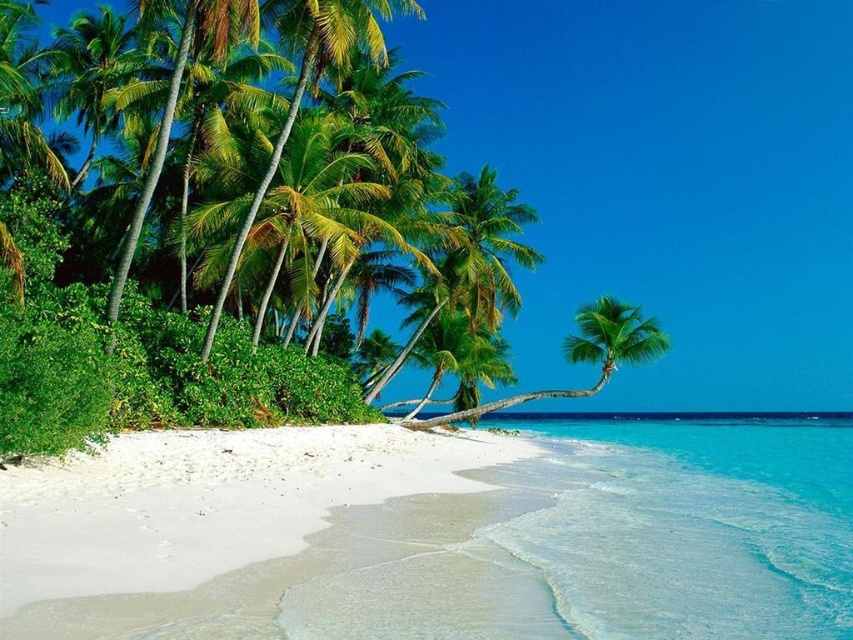
You are planning to set up a small tent on the white sandy beach at lower left and the green leafy palm tree at center. Based on their sizes, which location would provide more space for the tent?

The white sandy beach at lower left has a larger size compared to the green leafy palm tree at center, so setting up the tent there would provide more space.

Looking at this image, you are standing on the white sandy beach at lower left and want to reach the green leafy palm tree at center. Which direction should you move to get closer to the palm tree?

You should move towards the center of the image because the white sandy beach at lower left is in front of the green leafy palm tree at center, meaning the palm tree is behind the beach area from your current position.

You are standing at the point marked by the coordinates point (202, 518) on the white sandy beach at lower left. Looking towards the dense cluster of tall palm trees with lush green fronds on the left side, which direction should you walk to reach the palm trees?

You should walk towards the left side to reach the dense cluster of tall palm trees with lush green fronds on the left side from your current position at point (202, 518) on the white sandy beach at lower left.